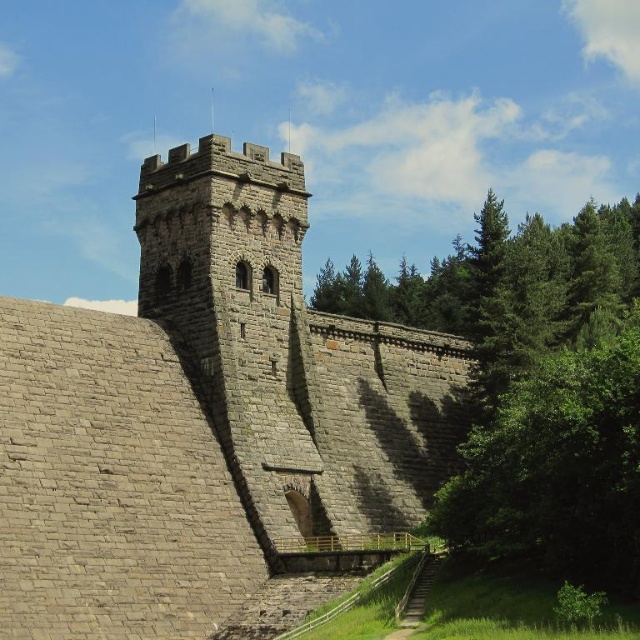
Between point (408, 369) and point (525, 384), which one is positioned in front?

Point (525, 384) is more forward.

Does gray stone castle at center appear on the left side of green leafy tree at lower right?

Correct, you'll find gray stone castle at center to the left of green leafy tree at lower right.

The height and width of the screenshot is (640, 640). I want to click on gray stone castle at center, so click(x=212, y=426).